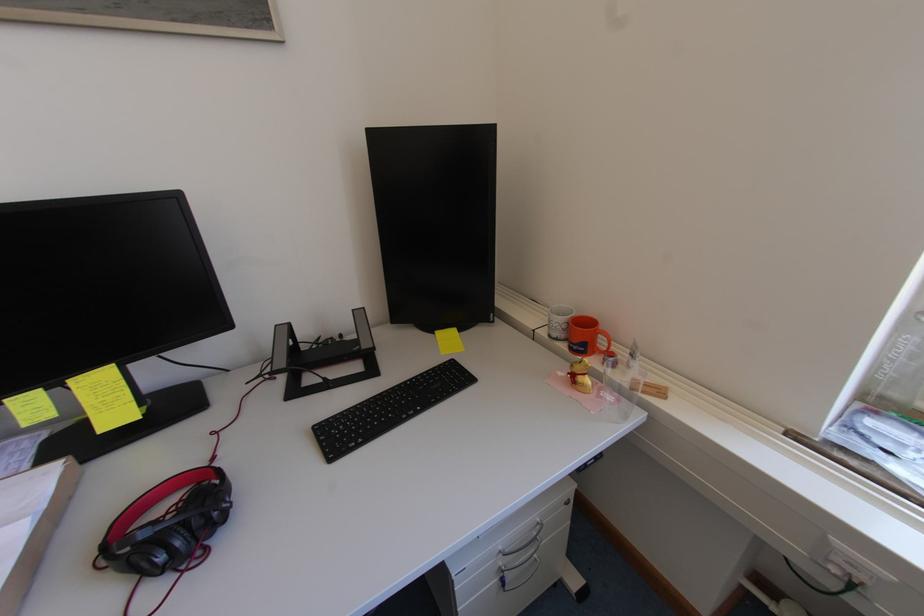
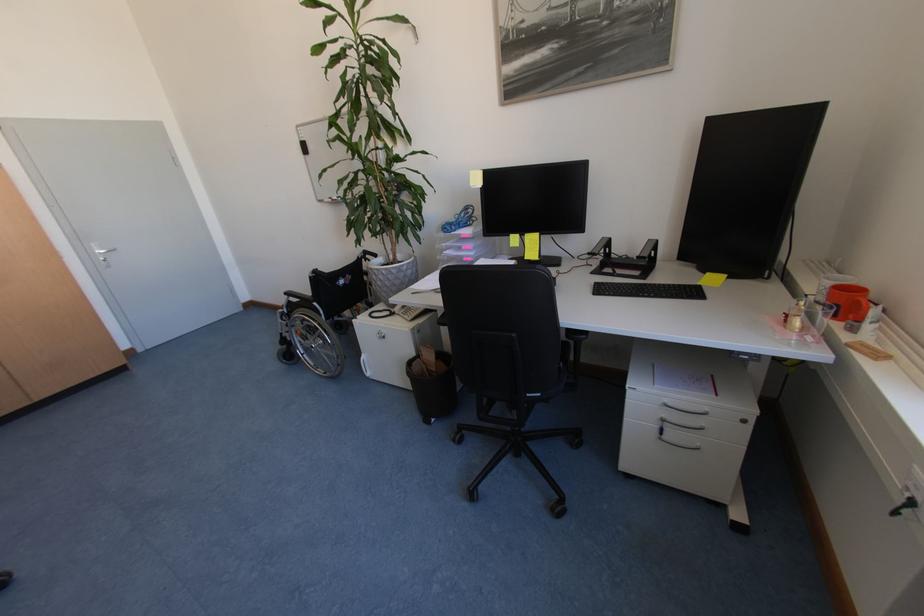
Where in the second image is the point corresponding to point (575, 504) from the first image?

(751, 422)